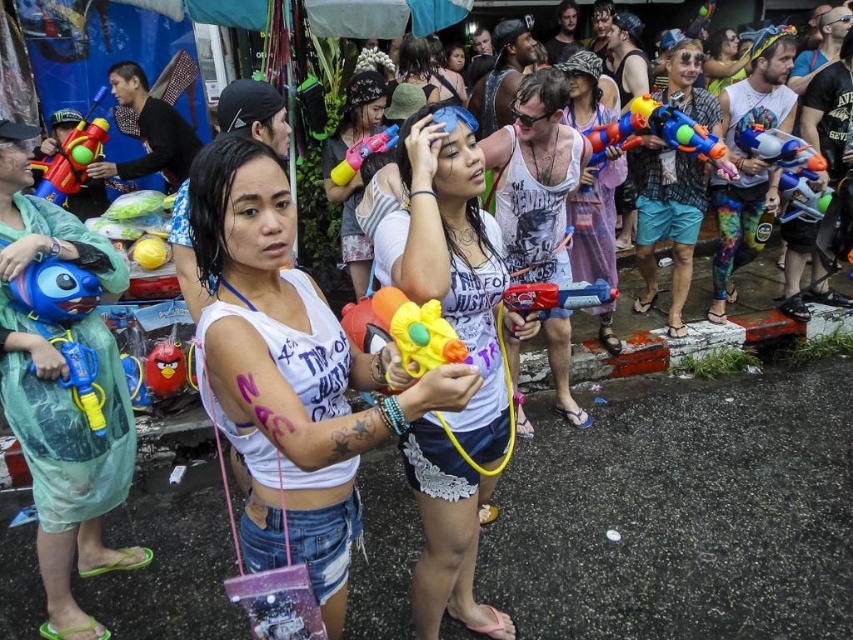
Can you confirm if multicolored plastic water gun at upper right is bigger than matte black sunglasses at upper center?

Yes.

Can you confirm if multicolored plastic water gun at upper right is taller than matte black sunglasses at upper center?

Incorrect, multicolored plastic water gun at upper right's height is not larger of matte black sunglasses at upper center's.

In order to click on multicolored plastic water gun at upper right in this screenshot , I will do `click(659, 134)`.

Which is in front, point (683, 124) or point (757, 128)?

Positioned in front is point (683, 124).

What do you see at coordinates (659, 134) in the screenshot? This screenshot has width=853, height=640. I see `multicolored plastic water gun at upper right` at bounding box center [659, 134].

The image size is (853, 640). In order to click on multicolored plastic water gun at upper right in this screenshot , I will do `click(659, 134)`.

Is matte purple dress at center above pink rubber water gun at center?

Incorrect, matte purple dress at center is not positioned above pink rubber water gun at center.

Can you confirm if matte purple dress at center is bigger than pink rubber water gun at center?

Yes, matte purple dress at center is bigger than pink rubber water gun at center.

This screenshot has height=640, width=853. Describe the element at coordinates (595, 221) in the screenshot. I see `matte purple dress at center` at that location.

Identify the location of matte purple dress at center. (595, 221).